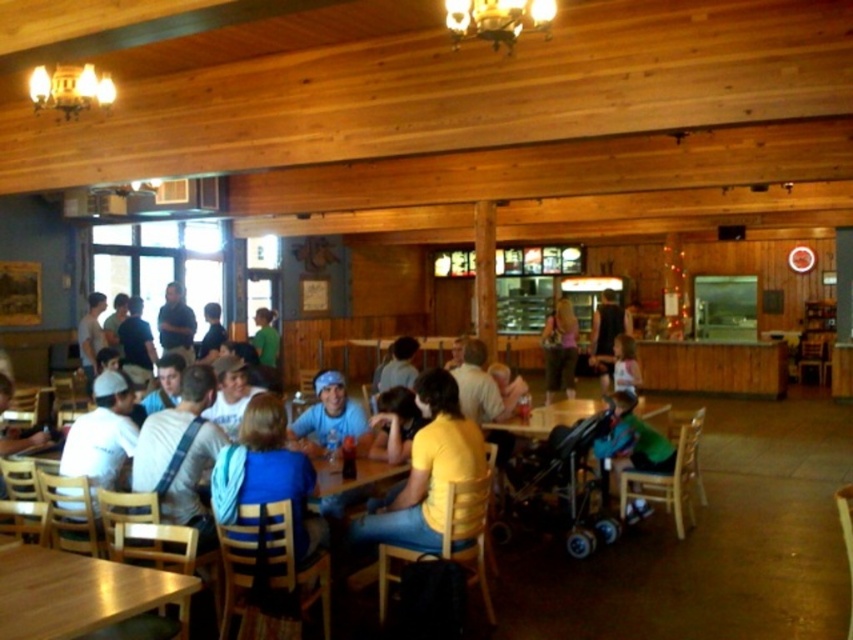
Question: Among these points, which one is farthest from the camera?

Choices:
 (A) (131, 436)
 (B) (91, 369)
 (C) (575, 352)
 (D) (259, 356)

Answer: (C)

Question: Can you confirm if yellow t-shirt at center is thinner than matte blue shirt at center?

Choices:
 (A) yes
 (B) no

Answer: (A)

Question: Which of the following is the closest to the observer?

Choices:
 (A) (125, 609)
 (B) (399, 384)
 (C) (91, 356)

Answer: (A)

Question: Which point is farther to the camera?

Choices:
 (A) blue fabric scarf at center
 (B) blue fabric cap at center

Answer: (B)

Question: In this image, where is wooden table at center located relative to light blue shirt at center?

Choices:
 (A) below
 (B) above

Answer: (A)

Question: Can you confirm if green fabric jacket at lower right is thinner than blue shirt at center?

Choices:
 (A) no
 (B) yes

Answer: (B)